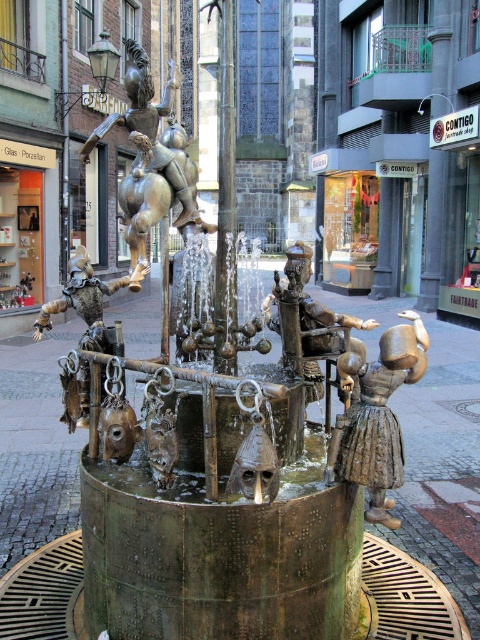
Does bronze statue at upper center appear under bronze figure at center?

Actually, bronze statue at upper center is above bronze figure at center.

Based on the photo, does bronze statue at upper center have a greater width compared to bronze figure at center?

Yes, bronze statue at upper center is wider than bronze figure at center.

Between point (144, 172) and point (422, 371), which one is positioned behind?

Positioned behind is point (144, 172).

What are the coordinates of `bronze statue at upper center` in the screenshot? It's located at (152, 157).